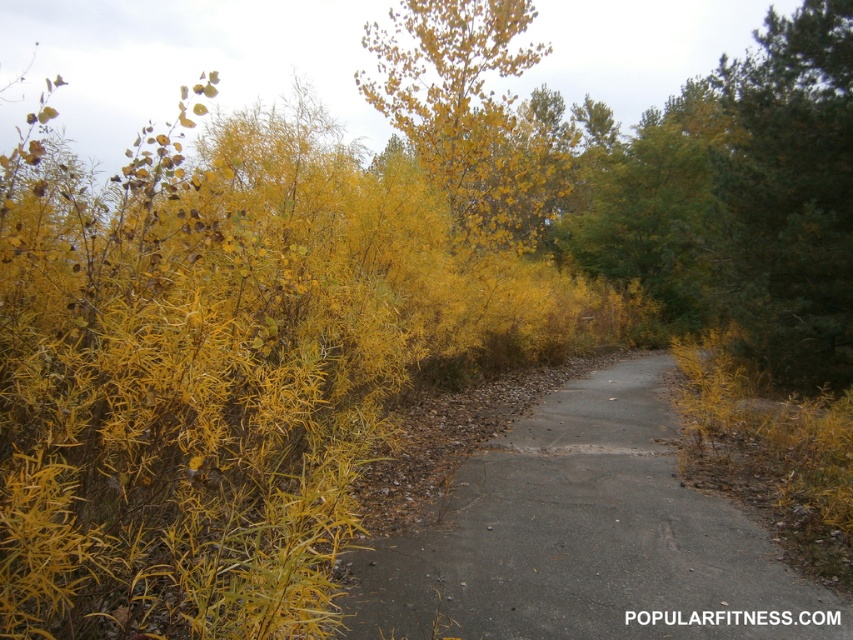
Is gray asphalt trail at center thinner than yellow leafy tree at upper center?

Yes.

In the scene shown: Who is more forward, (498, 609) or (410, 104)?

Point (498, 609)

Identify the location of gray asphalt trail at center. pos(585,538).